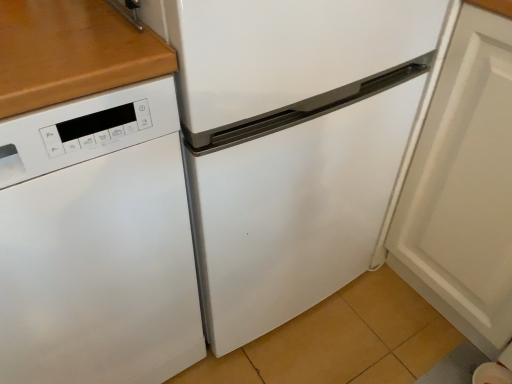
At what (x,y) coordinates should I click in order to perform the action: click on white matte dishwasher at left. Please return your answer as a coordinate pair (x, y). This screenshot has width=512, height=384. Looking at the image, I should click on (97, 242).

This screenshot has height=384, width=512. Describe the element at coordinates (97, 242) in the screenshot. I see `white matte dishwasher at left` at that location.

Locate an element on the screen. The image size is (512, 384). white matte cabinet door at lower right is located at coordinates (463, 188).

Measure the distance between white matte cabinet door at lower right and camera.

white matte cabinet door at lower right is 29.51 inches away from camera.

What do you see at coordinates (463, 188) in the screenshot? This screenshot has height=384, width=512. I see `white matte cabinet door at lower right` at bounding box center [463, 188].

The image size is (512, 384). Identify the location of white matte dishwasher at left. (97, 242).

Between white matte cabinet door at lower right and white matte dishwasher at left, which one appears on the left side from the viewer's perspective?

Positioned to the left is white matte dishwasher at left.

Is the depth of white matte cabinet door at lower right less than that of white matte dishwasher at left?

No, it is not.

Considering the points (451, 60) and (130, 254), which point is in front, point (451, 60) or point (130, 254)?

The point (130, 254) is in front.

From the image's perspective, is white matte cabinet door at lower right located above or below white matte dishwasher at left?

white matte cabinet door at lower right is above white matte dishwasher at left.

From a real-world perspective, is white matte cabinet door at lower right positioned above or below white matte dishwasher at left?

Clearly, from a real-world perspective, white matte cabinet door at lower right is above white matte dishwasher at left.

Can you confirm if white matte cabinet door at lower right is wider than white matte dishwasher at left?

No.

Between white matte cabinet door at lower right and white matte dishwasher at left, which one has more height?

white matte dishwasher at left is taller.

Is white matte cabinet door at lower right smaller than white matte dishwasher at left?

Yes.

Can we say white matte cabinet door at lower right lies outside white matte dishwasher at left?

white matte cabinet door at lower right is positioned outside white matte dishwasher at left.

Is white matte cabinet door at lower right with white matte dishwasher at left?

No, white matte cabinet door at lower right is not making contact with white matte dishwasher at left.

Is white matte cabinet door at lower right positioned with its back to white matte dishwasher at left?

white matte cabinet door at lower right does not have its back to white matte dishwasher at left.

What are the coordinates of `home appliance located in front of the white matte cabinet door at lower right` in the screenshot? It's located at (97, 242).

Considering the relative positions of white matte dishwasher at left and white matte cabinet door at lower right in the image provided, is white matte dishwasher at left to the left of white matte cabinet door at lower right from the viewer's perspective?

Yes.

Between white matte dishwasher at left and white matte cabinet door at lower right, which one is positioned behind?

white matte cabinet door at lower right is further from the camera.

Is point (87, 187) behind point (448, 206)?

No, it is not.

From the picture: From the image's perspective, is white matte dishwasher at left beneath white matte cabinet door at lower right?

Indeed, from the image's perspective, white matte dishwasher at left is shown beneath white matte cabinet door at lower right.

From a real-world perspective, is white matte dishwasher at left physically below white matte cabinet door at lower right?

Indeed, from a real-world perspective, white matte dishwasher at left is positioned beneath white matte cabinet door at lower right.

Looking at their sizes, would you say white matte dishwasher at left is wider or thinner than white matte cabinet door at lower right?

white matte dishwasher at left is wider than white matte cabinet door at lower right.

Is white matte dishwasher at left taller or shorter than white matte cabinet door at lower right?

Clearly, white matte dishwasher at left is taller compared to white matte cabinet door at lower right.

Can you confirm if white matte dishwasher at left is smaller than white matte cabinet door at lower right?

No, white matte dishwasher at left is not smaller than white matte cabinet door at lower right.

Would you say white matte dishwasher at left is inside or outside white matte cabinet door at lower right?

white matte dishwasher at left cannot be found inside white matte cabinet door at lower right.

Is white matte dishwasher at left touching white matte cabinet door at lower right?

They are not placed beside each other.

Is white matte dishwasher at left oriented towards white matte cabinet door at lower right?

No.

How many degrees apart are the facing directions of white matte dishwasher at left and white matte cabinet door at lower right?

white matte dishwasher at left and white matte cabinet door at lower right are facing 89 degrees away from each other.

Locate an element on the screen. The width and height of the screenshot is (512, 384). home appliance lying below the white matte cabinet door at lower right (from the image's perspective) is located at coordinates (97, 242).

The image size is (512, 384). What are the coordinates of `door behind the white matte dishwasher at left` in the screenshot? It's located at (463, 188).

I want to click on door on the right of white matte dishwasher at left, so click(463, 188).